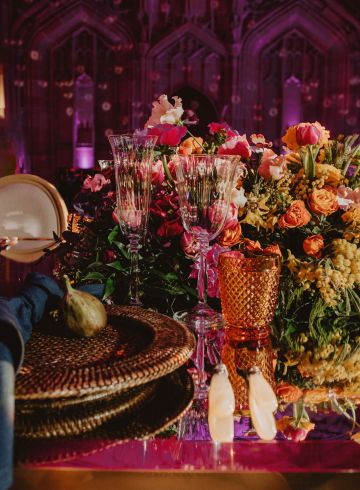
Image resolution: width=360 pixels, height=490 pixels. Identify the location of tray. (108, 368).